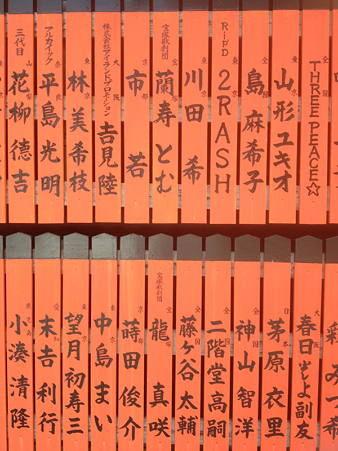
The width and height of the screenshot is (338, 451). Find the location of `blinds`. blinds is located at coordinates (195, 187).